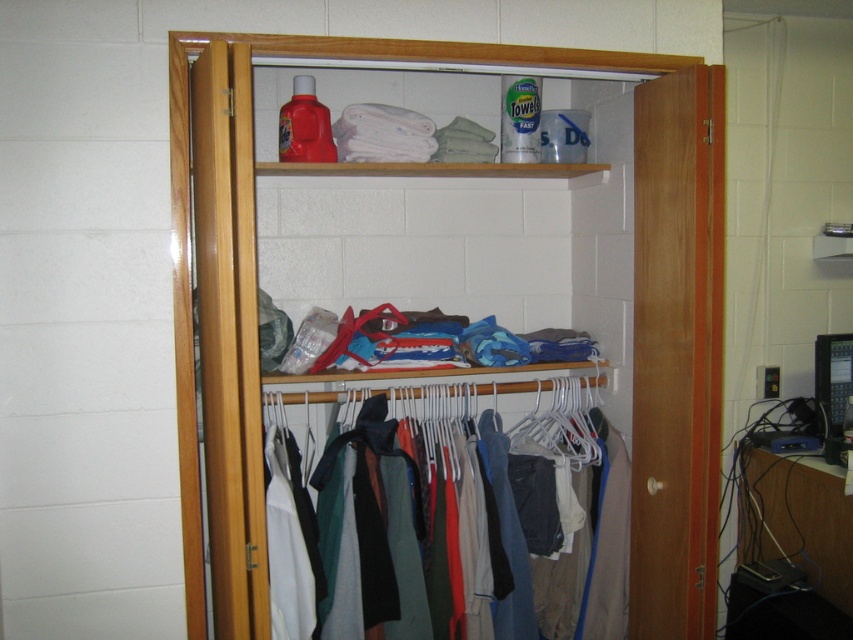
Question: Can you confirm if wooden hangers at center is wider than multicolored fabric clothes at center?

Choices:
 (A) yes
 (B) no

Answer: (A)

Question: Observing the image, what is the correct spatial positioning of wooden hangers at center in reference to multicolored fabric clothes at center?

Choices:
 (A) left
 (B) right

Answer: (B)

Question: Is wooden hangers at center above multicolored fabric clothes at center?

Choices:
 (A) no
 (B) yes

Answer: (B)

Question: Which object appears farthest from the camera in this image?

Choices:
 (A) multicolored fabric clothes at center
 (B) wooden hangers at center

Answer: (A)

Question: Among these points, which one is nearest to the camera?

Choices:
 (A) (476, 56)
 (B) (508, 532)

Answer: (A)